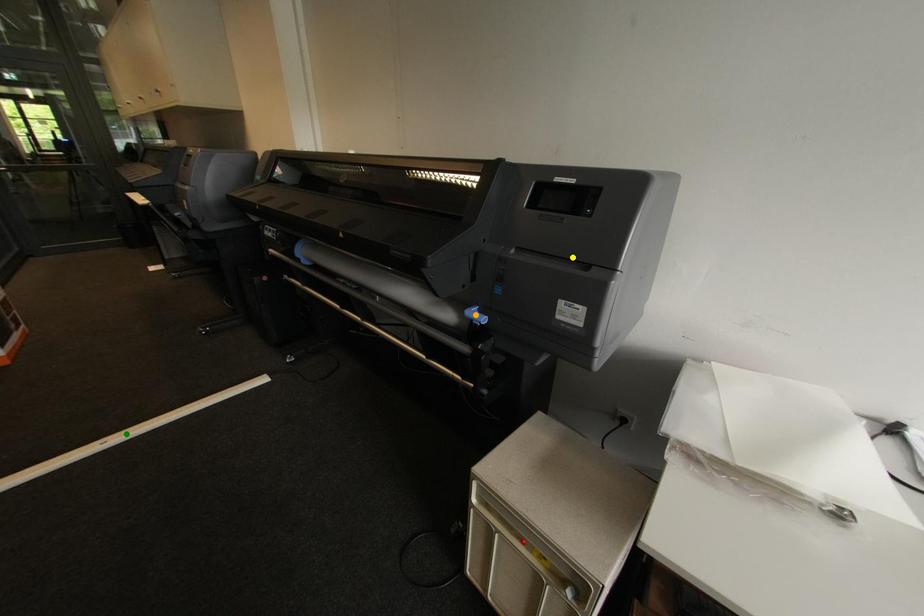
Order these from nearest to farthest:
orange point, green point, yellow point

yellow point < orange point < green point